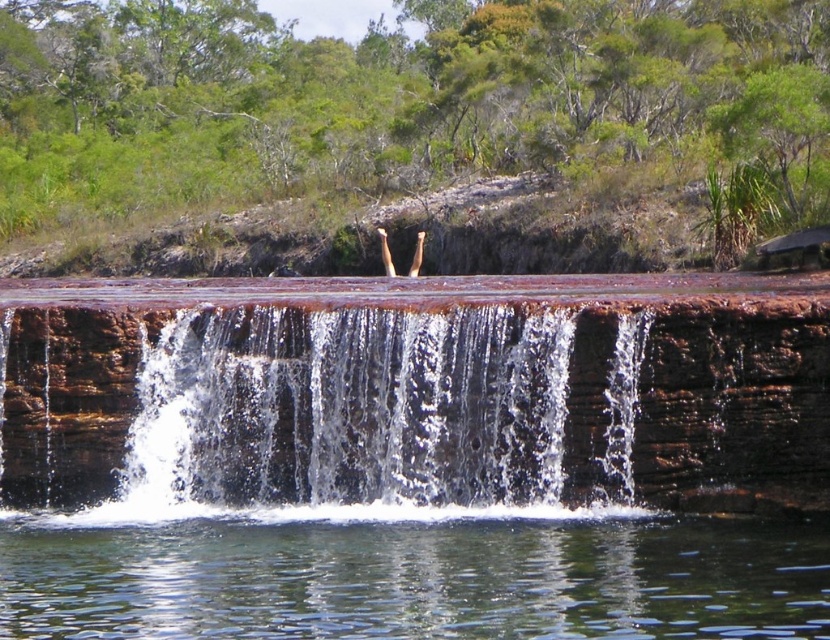
You are standing at the edge of the brown rock waterfall at center and looking towards the clear water at center. Which one is closer to you?

The brown rock waterfall at center is closer to you than the clear water at center because it is positioned further away from the viewer.

You are a hiker who wants to cross from the brown rock waterfall at center to the clear water at center. The path between them is 3.35 meters wide. If your backpack has a width of 1.5 meters, can you safely cross the gap?

Answer: The distance between the brown rock waterfall at center and the clear water at center is 3.35 meters. Since your backpack is only 1.5 meters wide, you can safely cross the gap as the distance is wider than your backpack.

You are standing at the edge of the brown rock waterfall at center. You want to jump into the calm water below. Is the point marked by point (326, 410) the best spot to jump from? Explain why or why not based on the scene description.

The point marked by point (326, 410) is the best spot to jump from because it directly marks the brown rock waterfall at center, which is the central and most prominent part of the waterfall leading into the calm body of water below.